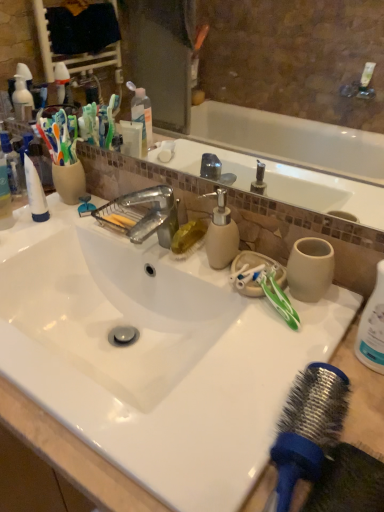
Where is `vacant space to the left of green plastic toothbrush at right`? This screenshot has height=512, width=384. vacant space to the left of green plastic toothbrush at right is located at coordinates (219, 321).